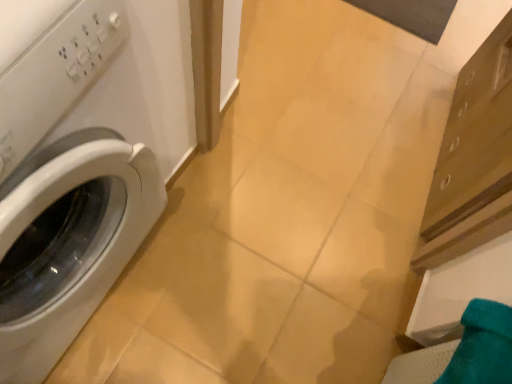
Question: Could you tell me if teal fabric towel at lower right is facing white glossy washing machine at left?

Choices:
 (A) yes
 (B) no

Answer: (B)

Question: Can white glossy washing machine at left be found inside teal fabric towel at lower right?

Choices:
 (A) no
 (B) yes

Answer: (A)

Question: Is teal fabric towel at lower right outside of white glossy washing machine at left?

Choices:
 (A) yes
 (B) no

Answer: (A)

Question: Does teal fabric towel at lower right lie behind white glossy washing machine at left?

Choices:
 (A) yes
 (B) no

Answer: (A)

Question: Can you see teal fabric towel at lower right touching white glossy washing machine at left?

Choices:
 (A) yes
 (B) no

Answer: (B)

Question: From a real-world perspective, is teal fabric towel at lower right on top of white glossy washing machine at left?

Choices:
 (A) yes
 (B) no

Answer: (B)

Question: Is white glossy washing machine at left turned away from teal fabric towel at lower right?

Choices:
 (A) yes
 (B) no

Answer: (B)

Question: Is white glossy washing machine at left thinner than teal fabric towel at lower right?

Choices:
 (A) yes
 (B) no

Answer: (B)

Question: Is white glossy washing machine at left wider than teal fabric towel at lower right?

Choices:
 (A) no
 (B) yes

Answer: (B)

Question: Does white glossy washing machine at left appear on the left side of teal fabric towel at lower right?

Choices:
 (A) yes
 (B) no

Answer: (A)

Question: Is white glossy washing machine at left bigger than teal fabric towel at lower right?

Choices:
 (A) no
 (B) yes

Answer: (B)

Question: From the image's perspective, is white glossy washing machine at left above teal fabric towel at lower right?

Choices:
 (A) no
 (B) yes

Answer: (B)

Question: Is white glossy washing machine at left bigger or smaller than teal fabric towel at lower right?

Choices:
 (A) big
 (B) small

Answer: (A)